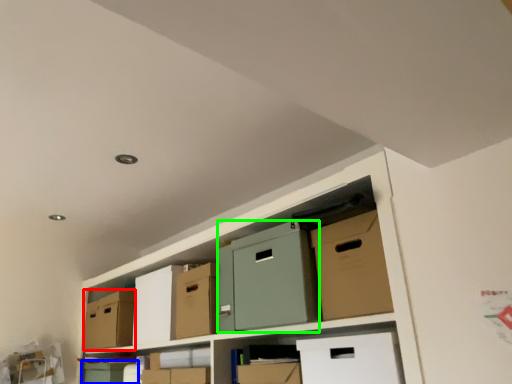
Question: Which object is positioned farthest from cardboard box (highlighted by a red box)? Select from box (highlighted by a blue box) and wide (highlighted by a green box).

Choices:
 (A) box
 (B) wide

Answer: (B)